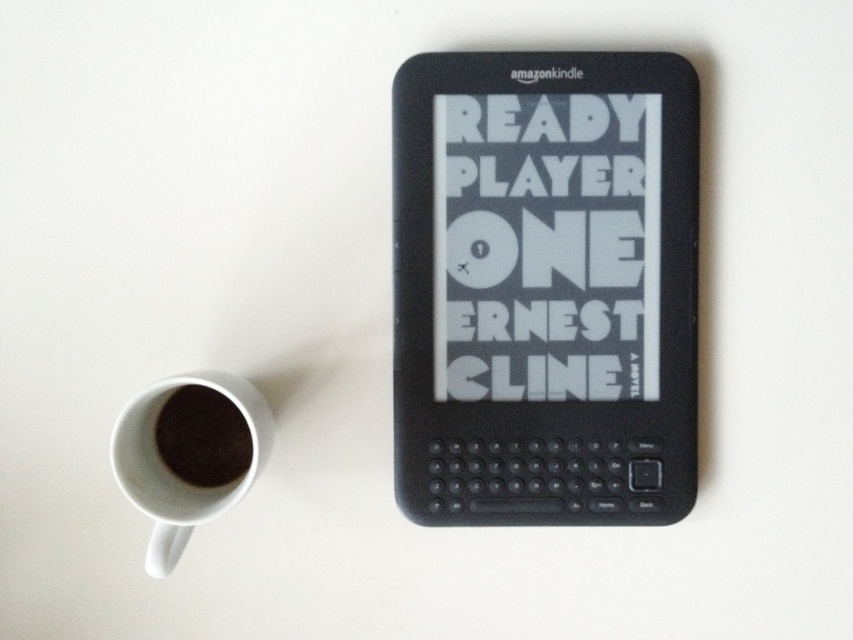
You are standing in front of the setup shown in the image. There is a point marked at coordinates (544, 288). What object is located at that point?

The point at coordinates (544, 288) marks the location of the black matte e reader at center.

You are a delivery drone flying at an altitude of 34 inches above the ground. You need to land on the point marked at coordinates point (254, 472). Will your landing be successful?

The distance of point (254, 472) from camera is 34.31 inches. Since the drone is flying at 34 inches altitude, it is slightly lower than the required height to land safely. Therefore, the landing might not be successful.